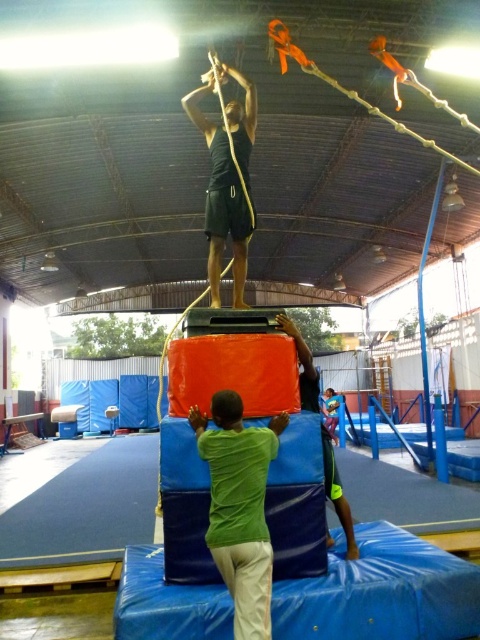
Question: Which object appears farthest from the camera in this image?

Choices:
 (A) green fabric person at center
 (B) matte black tank top at center
 (C) green matte shirt at center

Answer: (B)

Question: Which object is positioned closest to the green matte shirt at center?

Choices:
 (A) green fabric person at center
 (B) matte black tank top at center

Answer: (A)

Question: Is green matte shirt at center to the right of matte black tank top at center from the viewer's perspective?

Choices:
 (A) yes
 (B) no

Answer: (A)

Question: Estimate the real-world distances between objects in this image. Which object is closer to the green matte shirt at center?

Choices:
 (A) green fabric person at center
 (B) matte black tank top at center

Answer: (A)

Question: Does green matte shirt at center appear on the right side of matte black tank top at center?

Choices:
 (A) no
 (B) yes

Answer: (B)

Question: Is green matte shirt at center above green fabric person at center?

Choices:
 (A) no
 (B) yes

Answer: (A)